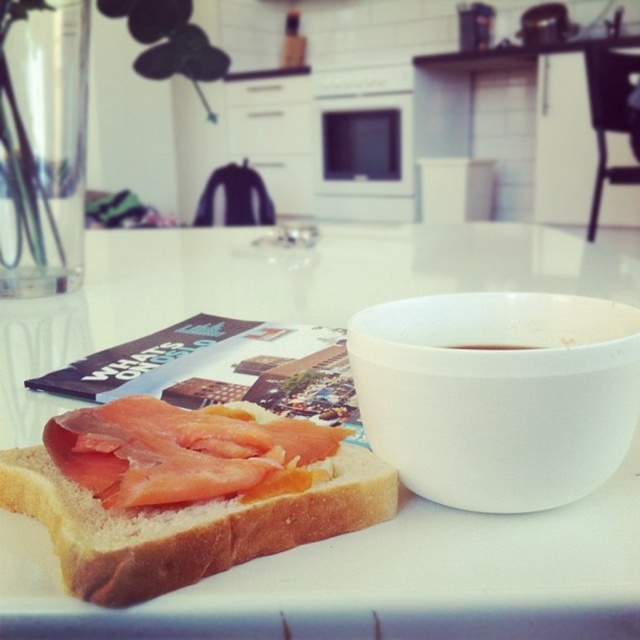
Is point (211, 589) positioned before point (476, 342)?

Yes.

Does white glossy table at center come in front of brown matte bowl at right?

Yes, white glossy table at center is in front of brown matte bowl at right.

Describe the element at coordinates (378, 579) in the screenshot. This screenshot has width=640, height=640. I see `white glossy table at center` at that location.

At what (x,y) coordinates should I click in order to perform the action: click on white glossy table at center. Please return your answer as a coordinate pair (x, y). The height and width of the screenshot is (640, 640). Looking at the image, I should click on (378, 579).

Which of these two, pinkish salmon at center or brown matte bowl at right, stands shorter?

With less height is brown matte bowl at right.

Can you confirm if pinkish salmon at center is thinner than brown matte bowl at right?

No.

Is point (369, 513) closer to viewer compared to point (444, 346)?

Yes, it is in front of point (444, 346).

Identify the location of pinkish salmon at center. (186, 492).

Does white glossy table at center appear under pinkish salmon at center?

No, white glossy table at center is not below pinkish salmon at center.

Is white glossy table at center above pinkish salmon at center?

Indeed, white glossy table at center is positioned over pinkish salmon at center.

Is point (484, 600) behind point (289, 461)?

No, it is in front of (289, 461).

Where is `white glossy table at center`? white glossy table at center is located at coordinates (378, 579).